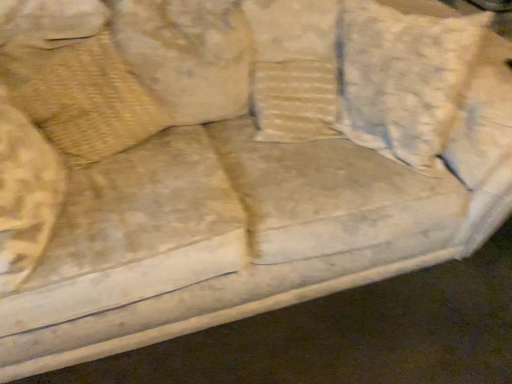
Question: From a real-world perspective, is washed cotton pillow at center, which appears as the first pillow when viewed from the right, above or below beige textured pillow at upper left, the second pillow in the right-to-left sequence?

Choices:
 (A) above
 (B) below

Answer: (A)

Question: Looking at the image, does washed cotton pillow at center, the second pillow positioned from the left, seem bigger or smaller compared to beige textured pillow at upper left, which is the first pillow in left-to-right order?

Choices:
 (A) big
 (B) small

Answer: (A)

Question: Is washed cotton pillow at center, the second pillow positioned from the left, inside or outside of beige textured pillow at upper left, the second pillow in the right-to-left sequence?

Choices:
 (A) outside
 (B) inside

Answer: (A)

Question: Is beige textured pillow at upper left, the second pillow in the right-to-left sequence, inside or outside of washed cotton pillow at center, the second pillow positioned from the left?

Choices:
 (A) outside
 (B) inside

Answer: (A)

Question: In terms of height, does beige textured pillow at upper left, which is the first pillow in left-to-right order, look taller or shorter compared to washed cotton pillow at center, which appears as the first pillow when viewed from the right?

Choices:
 (A) tall
 (B) short

Answer: (B)

Question: Is point (100, 48) closer or farther from the camera than point (417, 157)?

Choices:
 (A) closer
 (B) farther

Answer: (A)

Question: From a real-world perspective, is beige textured pillow at upper left, the second pillow in the right-to-left sequence, above or below washed cotton pillow at center, the second pillow positioned from the left?

Choices:
 (A) above
 (B) below

Answer: (B)